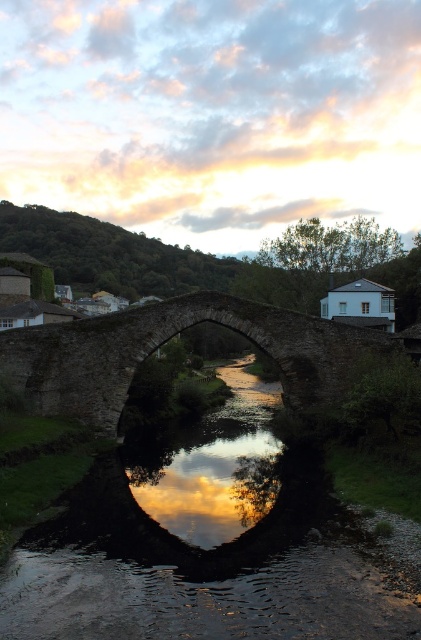
Question: Can you confirm if reflective stone river at center is bigger than stone arch bridge at center?

Choices:
 (A) yes
 (B) no

Answer: (B)

Question: Can you confirm if reflective stone river at center is positioned below stone arch bridge at center?

Choices:
 (A) yes
 (B) no

Answer: (A)

Question: Which object is closer to the camera taking this photo?

Choices:
 (A) reflective stone river at center
 (B) stone arch bridge at center

Answer: (A)

Question: Can you confirm if reflective stone river at center is thinner than stone arch bridge at center?

Choices:
 (A) yes
 (B) no

Answer: (A)